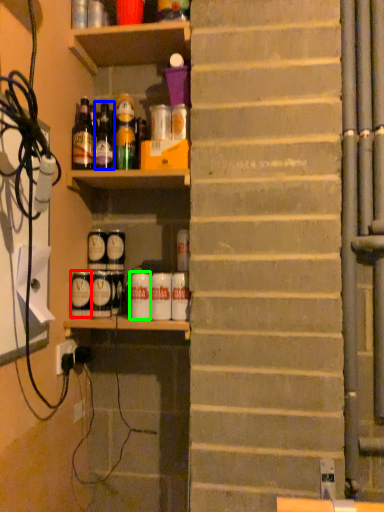
Question: Estimate the real-world distances between objects in this image. Which object is closer to beverage (highlighted by a red box), bottle (highlighted by a blue box) or beverage (highlighted by a green box)?

Choices:
 (A) bottle
 (B) beverage

Answer: (B)